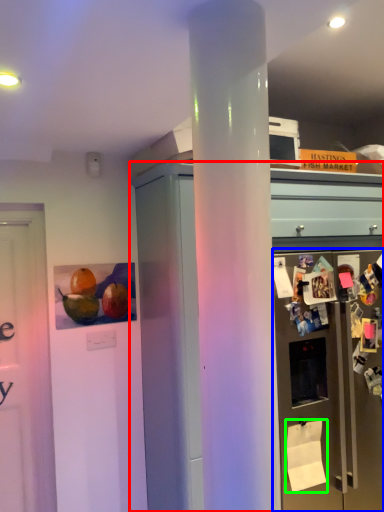
Question: Considering the real-world distances, which object is farthest from cabinetry (highlighted by a red box)? refrigerator (highlighted by a blue box) or toilet paper (highlighted by a green box)?

Choices:
 (A) refrigerator
 (B) toilet paper

Answer: (B)